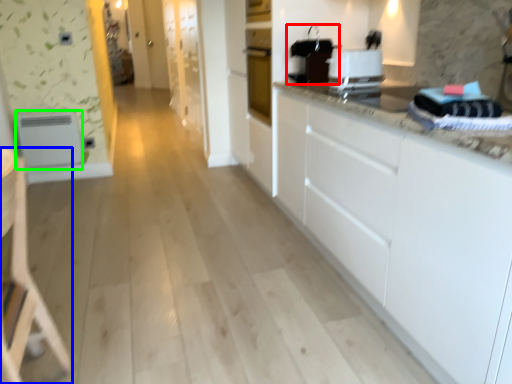
Question: Estimate the real-world distances between objects in this image. Which object is closer to appliance (highlighted by a red box), armchair (highlighted by a blue box) or appliance (highlighted by a green box)?

Choices:
 (A) armchair
 (B) appliance

Answer: (A)